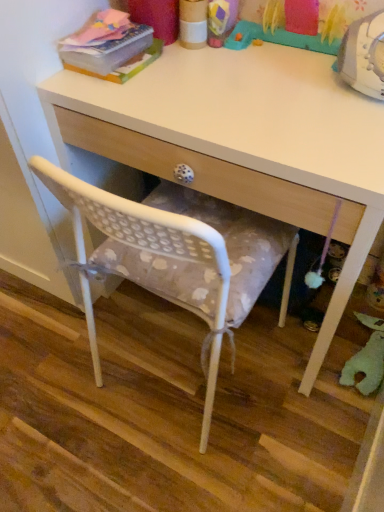
Locate an element on the screen. The height and width of the screenshot is (512, 384). vacant area that is in front of plastic toy at upper center, the 1th toy viewed from the left is located at coordinates (279, 91).